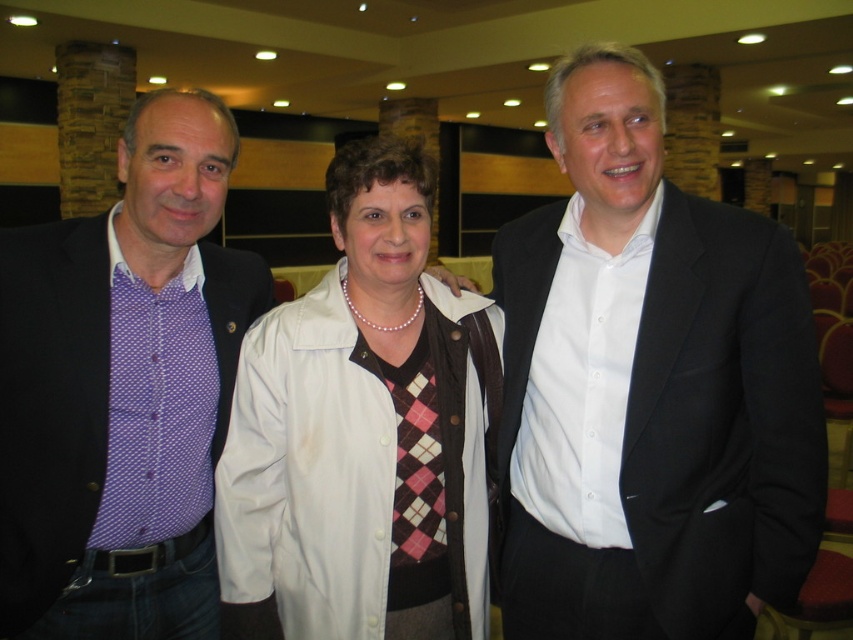
Question: Among these objects, which one is nearest to the camera?

Choices:
 (A) black matte suit at center
 (B) white leather jacket at center

Answer: (A)

Question: Which of the following is the farthest from the observer?

Choices:
 (A) white leather jacket at center
 (B) black matte suit at center

Answer: (A)

Question: From the image, what is the correct spatial relationship of black matte suit at center in relation to white leather jacket at center?

Choices:
 (A) right
 (B) left

Answer: (A)

Question: In this image, where is black matte suit at center located relative to white leather jacket at center?

Choices:
 (A) below
 (B) above

Answer: (B)

Question: Is black matte suit at center smaller than purple dotted shirt at left?

Choices:
 (A) no
 (B) yes

Answer: (A)

Question: Which object appears closest to the camera in this image?

Choices:
 (A) black matte suit at center
 (B) white leather jacket at center

Answer: (A)